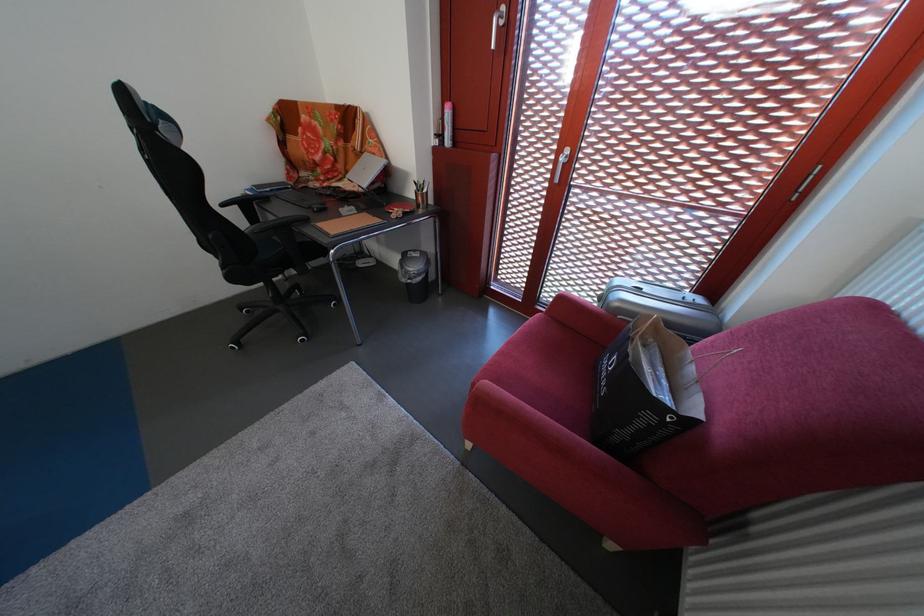
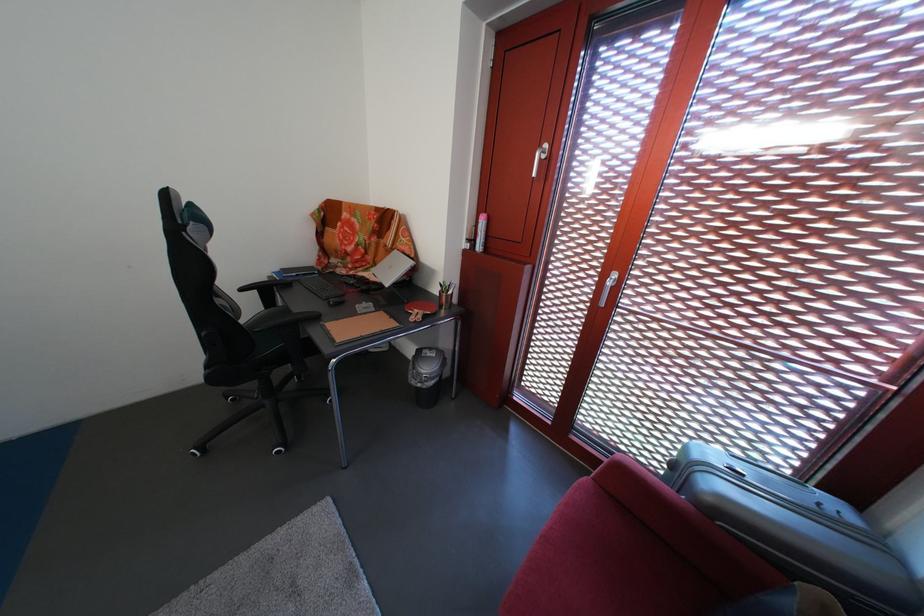
The point at [262,224] is marked in the first image. Where is the corresponding point in the second image?

(280, 308)